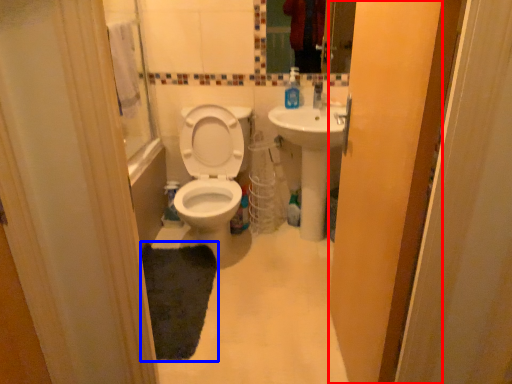
Question: Which object appears farthest to the camera in this image, screen door (highlighted by a red box) or mat (highlighted by a blue box)?

Choices:
 (A) screen door
 (B) mat

Answer: (B)